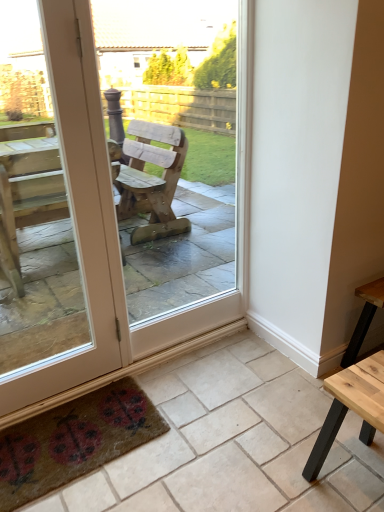
In order to click on wooden chair at center in this screenshot , I will do `click(113, 216)`.

What are the coordinates of `textured brown mat with ladybugs at lower left` in the screenshot? It's located at (74, 441).

What do you see at coordinates (74, 441) in the screenshot? This screenshot has width=384, height=512. I see `textured brown mat with ladybugs at lower left` at bounding box center [74, 441].

Locate an element on the screen. This screenshot has height=512, width=384. light brown wooden table at lower right is located at coordinates (351, 407).

Which is closer, (x=37, y=458) or (x=334, y=400)?

Point (x=37, y=458).

At what (x,y) coordinates should I click in order to perform the action: click on mat behind the light brown wooden table at lower right. Please return your answer as a coordinate pair (x, y). The width and height of the screenshot is (384, 512). Looking at the image, I should click on (74, 441).

Looking at this image, between textured brown mat with ladybugs at lower left and light brown wooden table at lower right, which one appears on the right side from the viewer's perspective?

From the viewer's perspective, light brown wooden table at lower right appears more on the right side.

From a real-world perspective, is textured brown mat with ladybugs at lower left positioned over light brown wooden table at lower right based on gravity?

Actually, textured brown mat with ladybugs at lower left is physically below light brown wooden table at lower right in the real world.

Considering the relative positions of light brown wooden table at lower right and brown textured mat at lower left in the image provided, is light brown wooden table at lower right behind brown textured mat at lower left?

That is True.

Is brown textured mat at lower left a part of light brown wooden table at lower right?

No, light brown wooden table at lower right does not contain brown textured mat at lower left.

Who is shorter, light brown wooden table at lower right or brown textured mat at lower left?

Standing shorter between the two is brown textured mat at lower left.

How many degrees apart are the facing directions of light brown wooden table at lower right and brown textured mat at lower left?

They differ by 90.5 degrees in their facing directions.

Consider the image. Considering the relative sizes of light brown wooden table at lower right and wooden chair at center in the image provided, is light brown wooden table at lower right smaller than wooden chair at center?

Indeed, light brown wooden table at lower right has a smaller size compared to wooden chair at center.

In the scene shown: Is light brown wooden table at lower right wider than wooden chair at center?

Indeed, light brown wooden table at lower right has a greater width compared to wooden chair at center.

Which object is further away from the camera, light brown wooden table at lower right or wooden chair at center?

wooden chair at center is more distant.

Is textured brown mat with ladybugs at lower left situated inside brown textured mat at lower left or outside?

textured brown mat with ladybugs at lower left is contained in brown textured mat at lower left.

What's the angular difference between textured brown mat with ladybugs at lower left and brown textured mat at lower left's facing directions?

1.1 degrees.

Can you see textured brown mat with ladybugs at lower left touching brown textured mat at lower left?

textured brown mat with ladybugs at lower left is not next to brown textured mat at lower left, and they're not touching.

From the image's perspective, is textured brown mat with ladybugs at lower left on brown textured mat at lower left?

Actually, textured brown mat with ladybugs at lower left appears below brown textured mat at lower left in the image.

Which is more to the right, brown textured mat at lower left or textured brown mat with ladybugs at lower left?

→ From the viewer's perspective, brown textured mat at lower left appears more on the right side.

Could you tell me if brown textured mat at lower left is facing textured brown mat with ladybugs at lower left?

No, brown textured mat at lower left is not facing towards textured brown mat with ladybugs at lower left.

Is point (307, 381) farther from viewer compared to point (54, 466)?

Yes, point (307, 381) is behind point (54, 466).

Find the location of a particular element. mat below the brown textured mat at lower left (from the image's perspective) is located at coordinates (74, 441).

From a real-world perspective, is brown textured mat at lower left physically located above or below light brown wooden table at lower right?

brown textured mat at lower left is situated lower than light brown wooden table at lower right in the real world.

Which of these two, brown textured mat at lower left or light brown wooden table at lower right, stands taller?

With more height is light brown wooden table at lower right.

From the image's perspective, which one is positioned higher, brown textured mat at lower left or light brown wooden table at lower right?

light brown wooden table at lower right appears higher in the image.

Which object is wider, wooden chair at center or brown textured mat at lower left?

Wider between the two is brown textured mat at lower left.

From the picture: Is wooden chair at center not inside brown textured mat at lower left?

Yes.

Between wooden chair at center and brown textured mat at lower left, which one has larger size?

wooden chair at center is bigger.

Is wooden chair at center taller than brown textured mat at lower left?

Indeed, wooden chair at center has a greater height compared to brown textured mat at lower left.

Where is `table on the right of textured brown mat with ladybugs at lower left`? Image resolution: width=384 pixels, height=512 pixels. table on the right of textured brown mat with ladybugs at lower left is located at coordinates (351, 407).

The width and height of the screenshot is (384, 512). What are the coordinates of `tile on the left of the light brown wooden table at lower right` in the screenshot? It's located at (234, 442).

Consider the image. Which object lies further to the anchor point light brown wooden table at lower right, brown textured mat at lower left or wooden chair at center?

wooden chair at center lies further to light brown wooden table at lower right than the other object.

Based on the photo, which object lies nearer to the anchor point brown textured mat at lower left, light brown wooden table at lower right or textured brown mat with ladybugs at lower left?

textured brown mat with ladybugs at lower left.

Which object lies further to the anchor point brown textured mat at lower left, textured brown mat with ladybugs at lower left or wooden chair at center?

The object further to brown textured mat at lower left is wooden chair at center.

Estimate the real-world distances between objects in this image. Which object is closer to textured brown mat with ladybugs at lower left, brown textured mat at lower left or wooden chair at center?

brown textured mat at lower left is positioned closer to the anchor textured brown mat with ladybugs at lower left.

When comparing their distances from wooden chair at center, does brown textured mat at lower left or light brown wooden table at lower right seem closer?

Based on the image, brown textured mat at lower left appears to be nearer to wooden chair at center.

Which object lies nearer to the anchor point textured brown mat with ladybugs at lower left, light brown wooden table at lower right or brown textured mat at lower left?

The object closer to textured brown mat with ladybugs at lower left is brown textured mat at lower left.

Considering their positions, is textured brown mat with ladybugs at lower left positioned closer to light brown wooden table at lower right than wooden chair at center?

textured brown mat with ladybugs at lower left lies closer to light brown wooden table at lower right than the other object.

Looking at the image, which one is located closer to light brown wooden table at lower right, brown textured mat at lower left or textured brown mat with ladybugs at lower left?

Among the two, brown textured mat at lower left is located nearer to light brown wooden table at lower right.

You are a GUI agent. You are given a task and a screenshot of the screen. Output one action in this format:
    pyautogui.click(x=<x>, y=<y>)
    Task: Click on the tile that lies between wooden chair at center and textured brown mat with ladybugs at lower left from top to bottom
    The width and height of the screenshot is (384, 512).
    Given the screenshot: What is the action you would take?
    pyautogui.click(x=234, y=442)

Identify the location of door between textured brown mat with ladybugs at lower left and light brown wooden table at lower right. (113, 216).

Find the location of `table between wooden chair at center and brown textured mat at lower left from top to bottom`. table between wooden chair at center and brown textured mat at lower left from top to bottom is located at coordinates (351, 407).

You are a GUI agent. You are given a task and a screenshot of the screen. Output one action in this format:
    pyautogui.click(x=<x>, y=<y>)
    Task: Click on the tile located between textured brown mat with ladybugs at lower left and light brown wooden table at lower right in the left-right direction
    
    Given the screenshot: What is the action you would take?
    pyautogui.click(x=234, y=442)